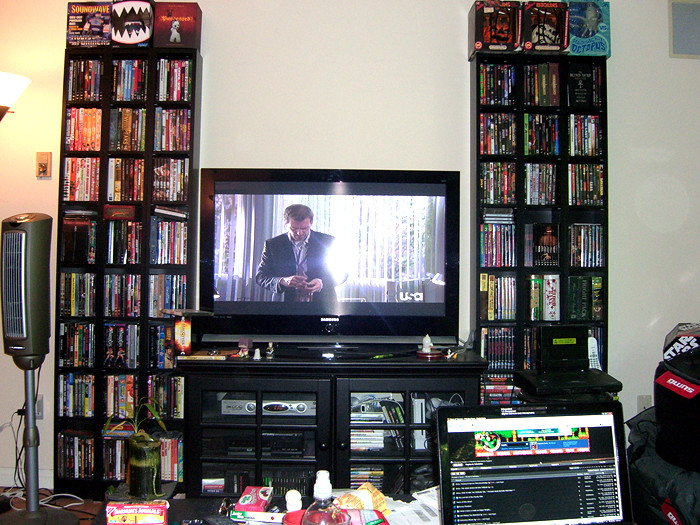
Find the location of a particular element. Image resolution: width=700 pixels, height=525 pixels. tv bezel is located at coordinates (368, 330).